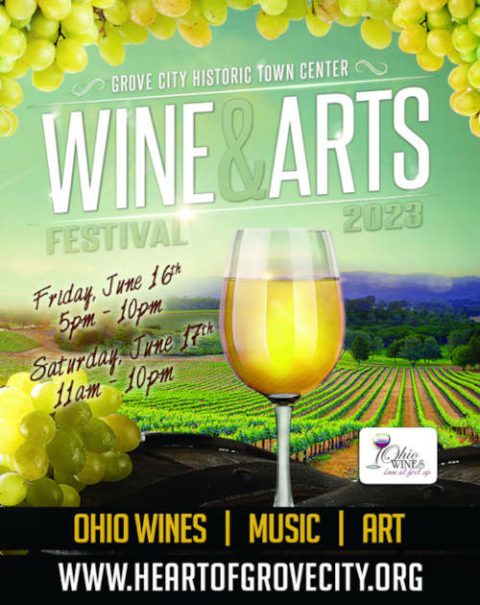
Where is `glass of wine`? This screenshot has width=480, height=605. glass of wine is located at coordinates (280, 333).